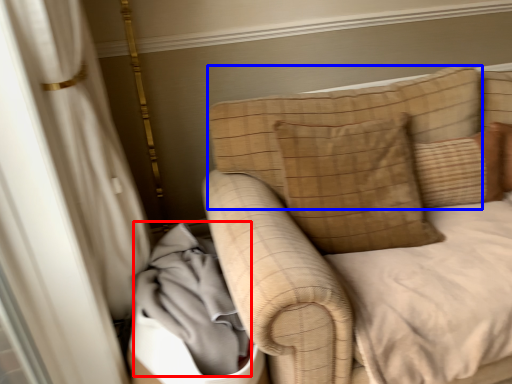
Question: Which object is further to the camera taking this photo, material (highlighted by a red box) or pillow (highlighted by a blue box)?

Choices:
 (A) material
 (B) pillow

Answer: (B)